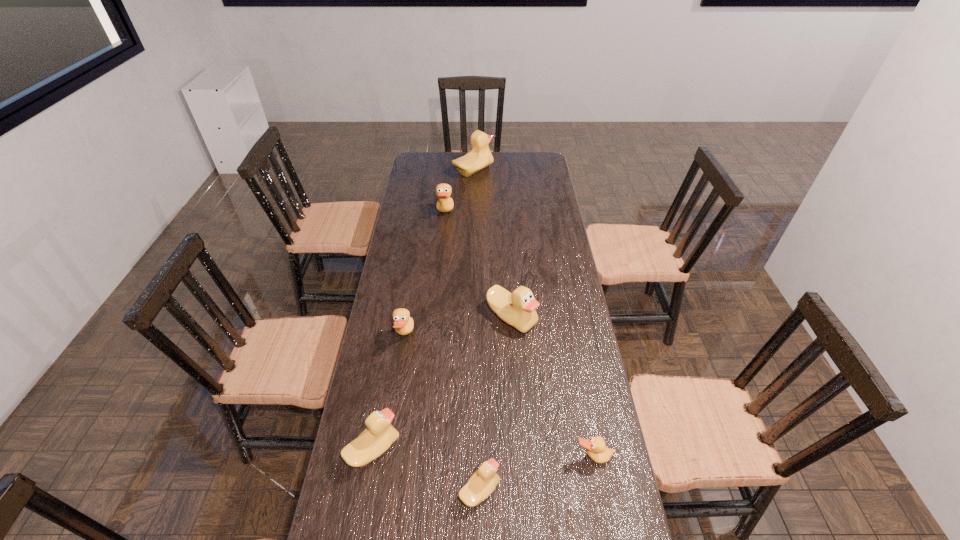
Identify the location of the farthest duck. Image resolution: width=960 pixels, height=540 pixels. (480, 157).

In order to click on the farthest beige duck in this screenshot , I will do `click(480, 157)`.

You are a GUI agent. You are given a task and a screenshot of the screen. Output one action in this format:
    pyautogui.click(x=<x>, y=<y>)
    Task: Click on the third smallest beige duck
    This screenshot has width=960, height=540.
    Given the screenshot: What is the action you would take?
    pyautogui.click(x=517, y=309)

This screenshot has width=960, height=540. Identify the location of the sixth nearest duck. (444, 204).

Identify the location of the biggest tan duck. The width and height of the screenshot is (960, 540). (444, 204).

Find the location of `the second smallest beige duck`. the second smallest beige duck is located at coordinates (379, 434).

Where is `the leftmost tan duck`? The width and height of the screenshot is (960, 540). the leftmost tan duck is located at coordinates (403, 323).

I want to click on the second farthest tan duck, so click(x=403, y=323).

Find the location of `the smallest beige duck`. the smallest beige duck is located at coordinates (482, 483).

The width and height of the screenshot is (960, 540). I want to click on the nearest tan duck, so click(596, 449).